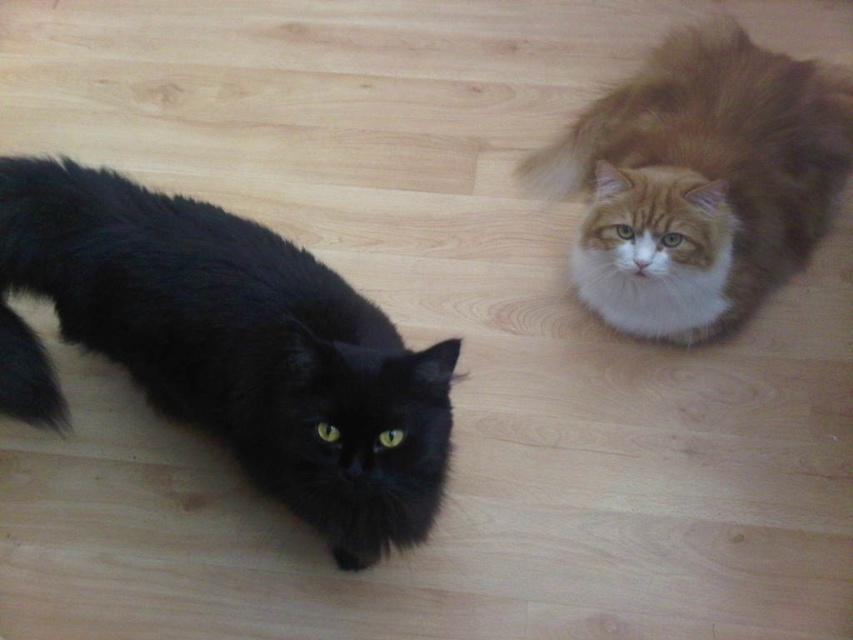
You are a photographer standing at a certain distance from the black fluffy cat at left. You want to take a photo of it but need to ensure you are exactly 40 inches away. Based on the scene description, are you currently too close or too far from the cat?

The black fluffy cat at left is 38.15 inches from the camera. Since you need to be 40 inches away, you are currently too close and should move back approximately 1.85 inches.

In the scene shown: You are standing in a room with two cats. You want to throw a small toy towards the cat on the right. The coordinates of the cats are point (399, 442) and point (556, 141). Which coordinate corresponds to the cat on the right?

Result: The point (399, 442) corresponds to the cat on the right because it is closer to the viewer than point (556, 141).

You are a photographer positioned at the center of the room. You want to take a photo of the black fluffy cat at left. Which direction should you move to get a better shot?

The black fluffy cat at left is located at point [229,348], so you should move to the left to get a better shot of it since it is positioned on the left side of the scene.